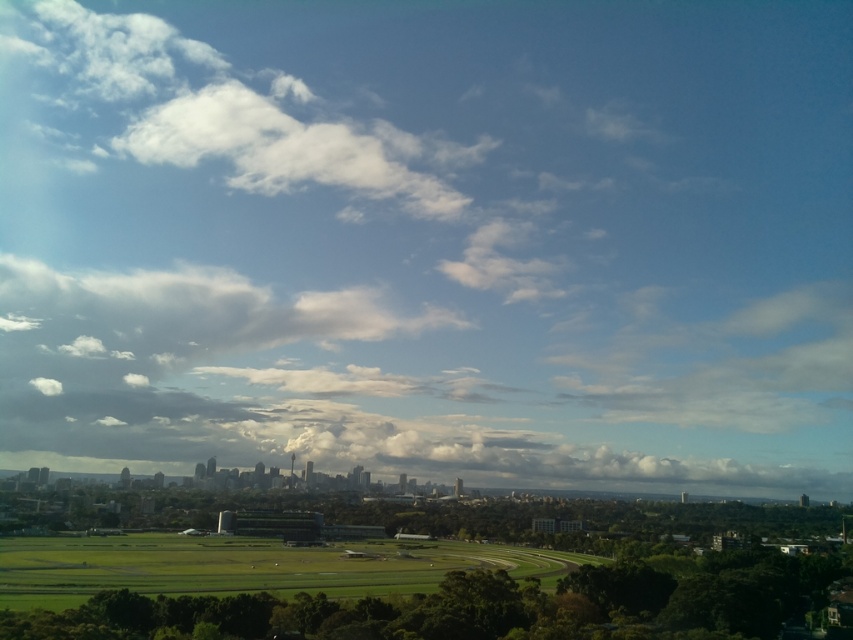
Is point (61, 336) farther from camera compared to point (323, 580)?

Yes, point (61, 336) is behind point (323, 580).

Can you confirm if white fluffy cloud at upper left is shorter than green grassy field at center?

In fact, white fluffy cloud at upper left may be taller than green grassy field at center.

Is point (242, 323) positioned in front of point (312, 568)?

That is False.

In order to click on white fluffy cloud at upper left in this screenshot , I will do `click(189, 310)`.